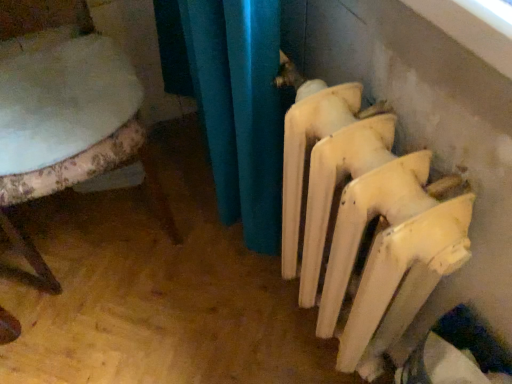
You are a GUI agent. You are given a task and a screenshot of the screen. Output one action in this format:
    pyautogui.click(x=<x>, y=<y>)
    Task: Click on the vacant space in white fabric chair at left (from a real-world perspective)
    Image resolution: width=512 pixels, height=384 pixels.
    Given the screenshot: What is the action you would take?
    pyautogui.click(x=97, y=220)